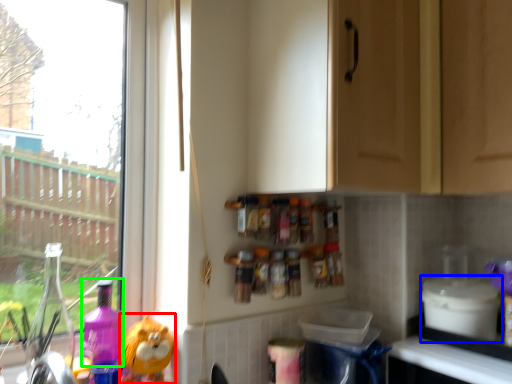
Question: Which object is the farthest from toy (highlighted by a red box)? Choose among these: appliance (highlighted by a blue box) or cleaning product (highlighted by a green box).

Choices:
 (A) appliance
 (B) cleaning product

Answer: (A)